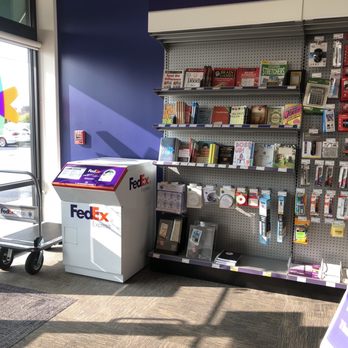
Where is `gray shelf`? Image resolution: width=348 pixels, height=348 pixels. gray shelf is located at coordinates (241, 223).